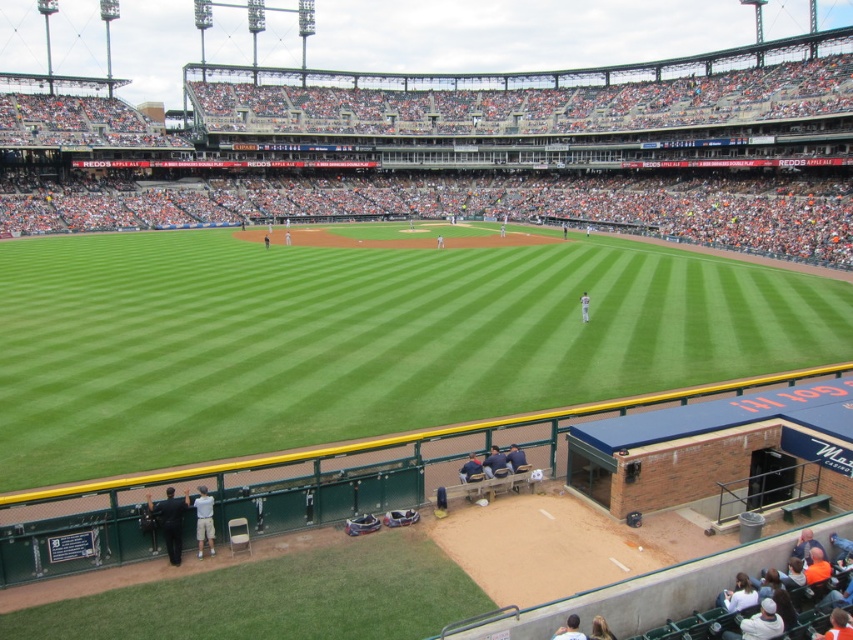
Consider the image. Who is positioned more to the right, blue fabric jacket at lower center or white uniform at center?

From the viewer's perspective, white uniform at center appears more on the right side.

Is blue fabric jacket at lower center above white uniform at center?

No.

You are a GUI agent. You are given a task and a screenshot of the screen. Output one action in this format:
    pyautogui.click(x=<x>, y=<y>)
    Task: Click on the blue fabric jacket at lower center
    This screenshot has width=853, height=640.
    Given the screenshot: What is the action you would take?
    pyautogui.click(x=492, y=461)

Which is more to the right, green grass field at center or light brown hair at lower center?

Positioned to the right is light brown hair at lower center.

What do you see at coordinates (358, 340) in the screenshot? The width and height of the screenshot is (853, 640). I see `green grass field at center` at bounding box center [358, 340].

Is point (194, 262) closer to viewer compared to point (550, 637)?

No, it is not.

At what (x,y) coordinates should I click in order to perform the action: click on green grass field at center. Please return your answer as a coordinate pair (x, y). The height and width of the screenshot is (640, 853). Looking at the image, I should click on (358, 340).

Is dark suit at lower left to the right of blue fabric jacket at lower center from the viewer's perspective?

No, dark suit at lower left is not to the right of blue fabric jacket at lower center.

Is point (167, 502) closer to camera compared to point (495, 458)?

Yes, point (167, 502) is in front of point (495, 458).

The height and width of the screenshot is (640, 853). Describe the element at coordinates (169, 522) in the screenshot. I see `dark suit at lower left` at that location.

Find the location of a particular element. dark suit at lower left is located at coordinates (169, 522).